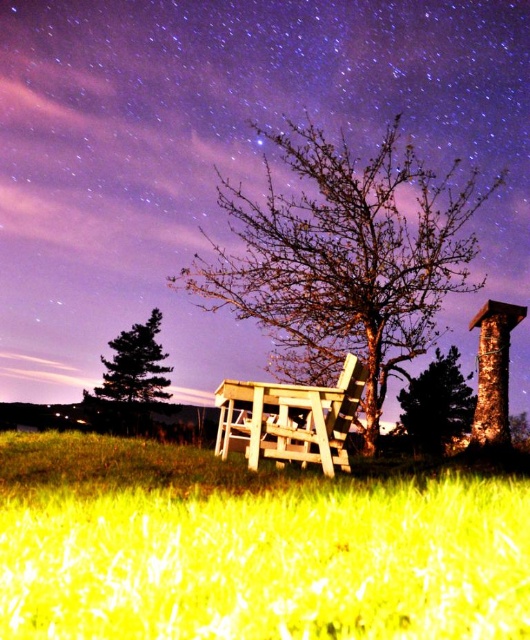
Can you confirm if wooden table at center is positioned above green textured tree at center?

Yes, wooden table at center is above green textured tree at center.

Does wooden table at center have a lesser height compared to green textured tree at center?

No.

Which is behind, point (304, 80) or point (400, 420)?

Point (304, 80)

Find the location of a particular element. The width and height of the screenshot is (530, 640). wooden table at center is located at coordinates (222, 156).

Which is in front, point (457, 3) or point (197, 518)?

Positioned in front is point (197, 518).

Which is more to the right, wooden table at center or green grass at lower center?

From the viewer's perspective, green grass at lower center appears more on the right side.

Does point (384, 106) come farther from viewer compared to point (175, 579)?

Yes, point (384, 106) is farther from viewer.

Find the location of a particular element. The image size is (530, 640). wooden table at center is located at coordinates (222, 156).

Is wooden table at center above smooth wooden tree at center?

Correct, wooden table at center is located above smooth wooden tree at center.

Is point (2, 84) behind point (222, 205)?

Yes, point (2, 84) is farther from viewer.

Image resolution: width=530 pixels, height=640 pixels. I want to click on wooden table at center, so click(x=222, y=156).

At what (x,y) coordinates should I click in order to perform the action: click on wooden table at center. Please return your answer as a coordinate pair (x, y). Looking at the image, I should click on (222, 156).